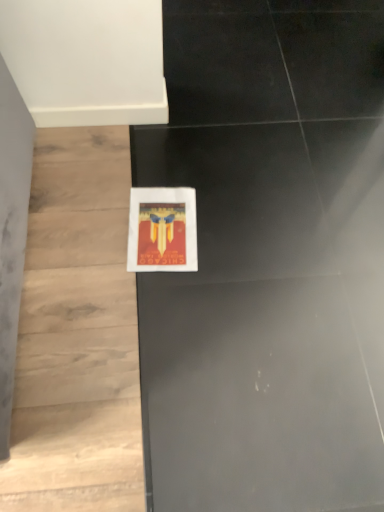
In order to click on free space above matte paper picture frame at center (from a real-world perspective) in this screenshot , I will do `click(159, 227)`.